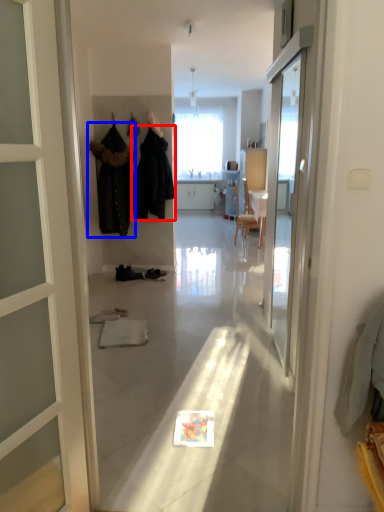
Question: Which point is closer to the camera, clothing (highlighted by a red box) or clothing (highlighted by a blue box)?

Choices:
 (A) clothing
 (B) clothing

Answer: (A)